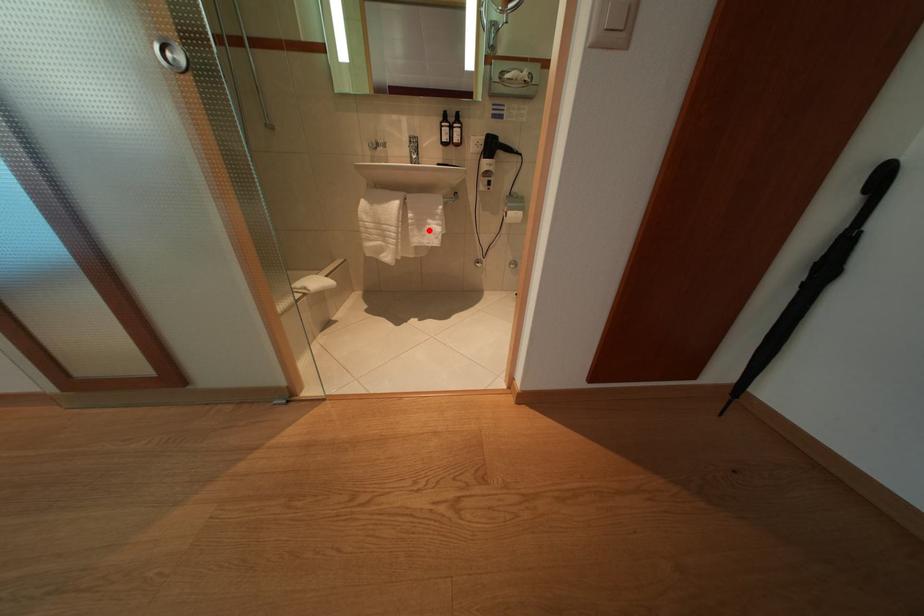
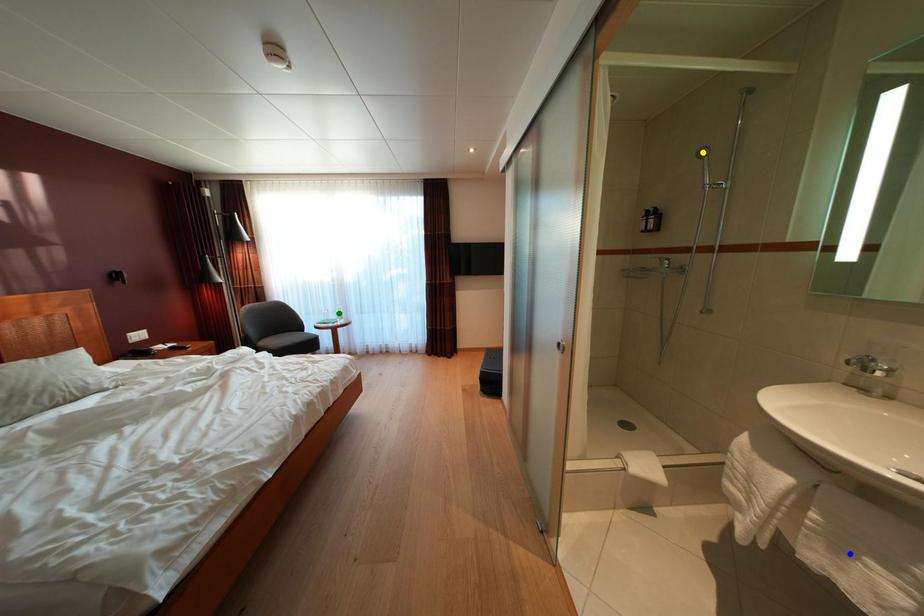
Question: I am providing you with two images of the same scene from different viewpoints. A red point is marked on the first image. You are given multiple points on the second image. Can you choose the point in image 2 that corresponds to the point in image 1?

Choices:
 (A) yellow point
 (B) green point
 (C) blue point

Answer: (C)